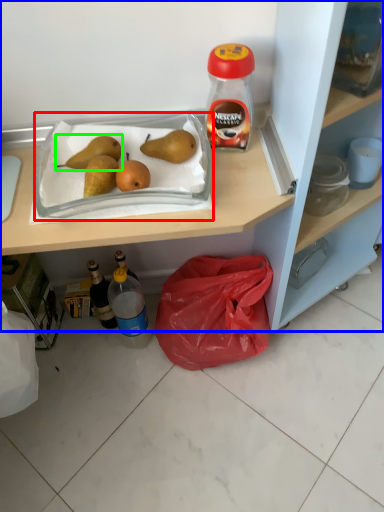
Question: Based on their relative distances, which object is farther from wide (highlighted by a red box)? Choose from cabinetry (highlighted by a blue box) and pear (highlighted by a green box).

Choices:
 (A) cabinetry
 (B) pear

Answer: (A)